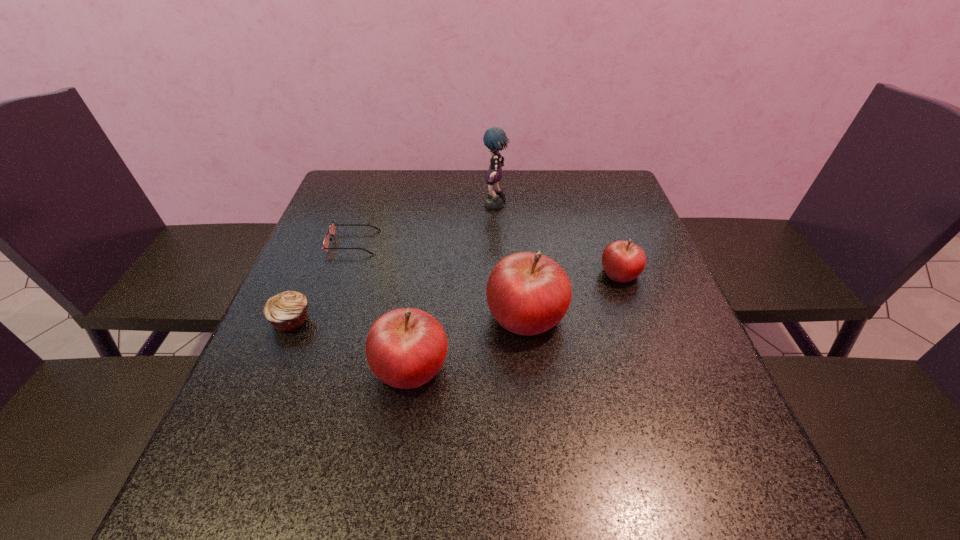
Please show where to add a apple on the left while keeping spacing even. Please provide its 2D coordinates. Your answer should be formatted as a tuple, i.e. [(x, y)], where the tuple contains the x and y coordinates of a point satisfying the conditions above.

[(263, 432)]